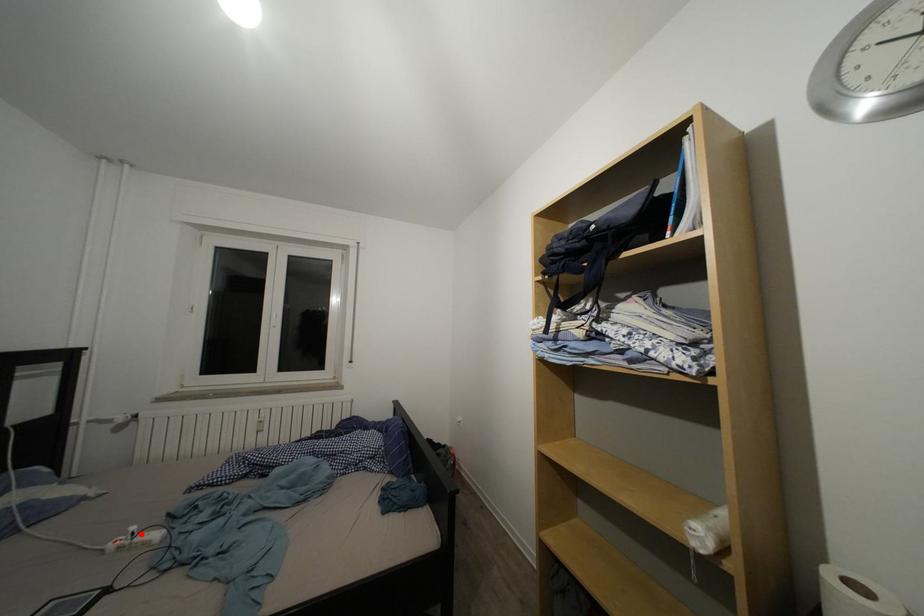
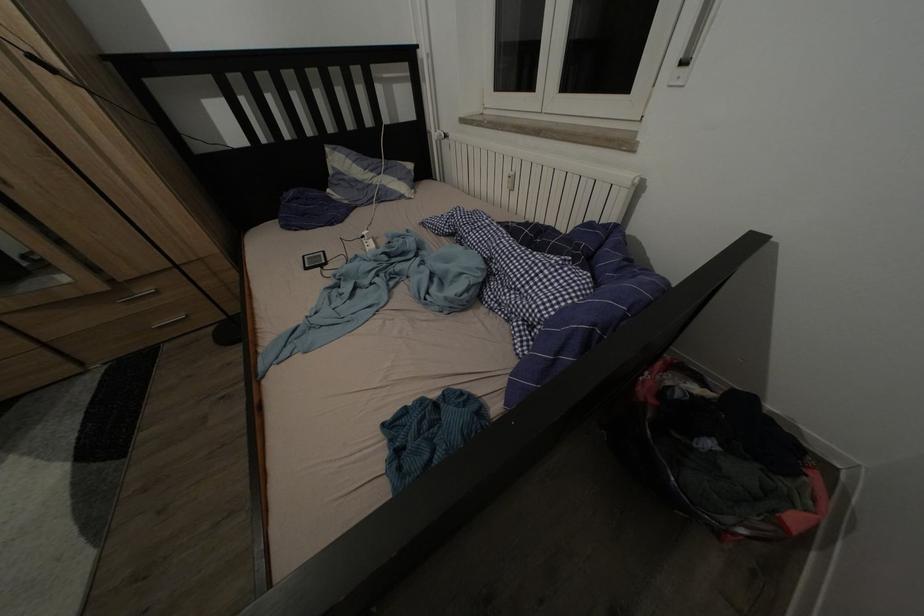
Find the pixel in the second image that matches the highlighted location in the first image.

(372, 238)